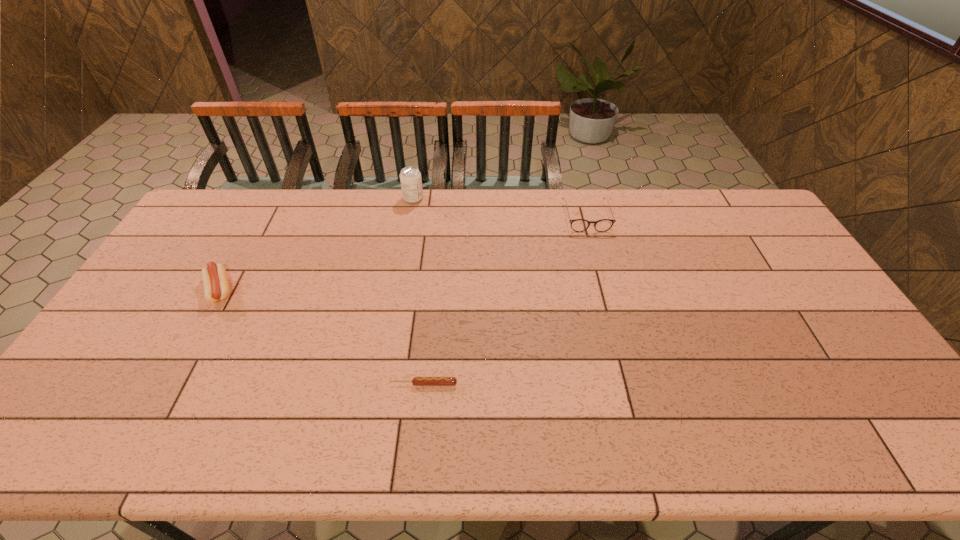
Locate an element on the screen. the tallest object is located at coordinates (410, 177).

Find the location of a particular element. spectacles is located at coordinates (578, 225).

I want to click on the leftmost object, so click(x=215, y=280).

Where is `the second nearest object`? This screenshot has width=960, height=540. the second nearest object is located at coordinates (215, 280).

Where is `the right sausage`? The height and width of the screenshot is (540, 960). the right sausage is located at coordinates (417, 381).

Image resolution: width=960 pixels, height=540 pixels. In order to click on the nearer sausage in this screenshot , I will do `click(417, 381)`.

The image size is (960, 540). I want to click on free space located on the right of the tallest object, so click(x=440, y=198).

Find the location of `free space located 0.300m through the lenses of the spectacles`. free space located 0.300m through the lenses of the spectacles is located at coordinates (609, 299).

You are a GUI agent. You are given a task and a screenshot of the screen. Output one action in this format:
    pyautogui.click(x=<x>, y=<y>)
    Task: Click on the blank area located 0.110m on the back of the taller sausage
    The height and width of the screenshot is (540, 960).
    Given the screenshot: What is the action you would take?
    pyautogui.click(x=243, y=249)

Identify the location of blank space located 0.130m on the front of the shorter sausage. (419, 438).